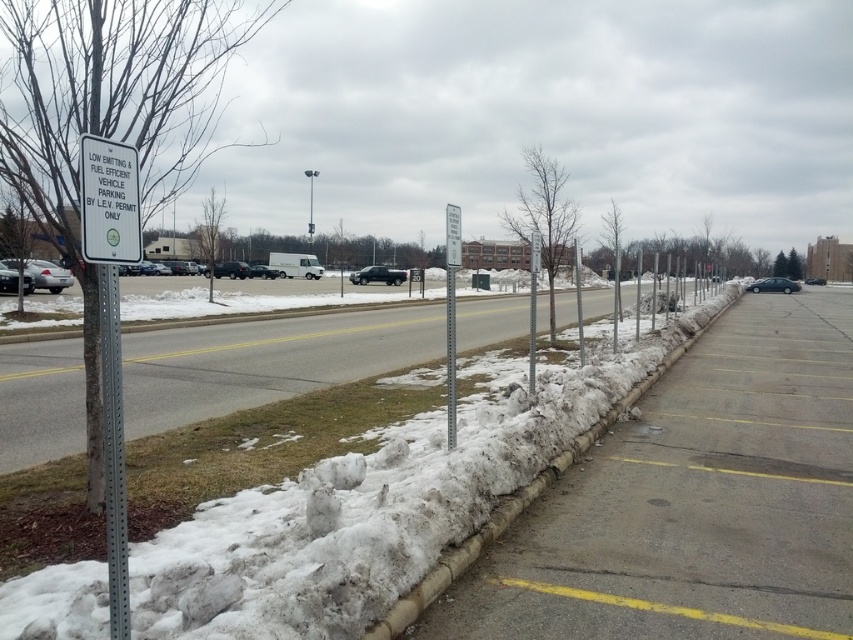
Which is more to the right, gray asphalt pavement at center or white fluffy snow at center?

gray asphalt pavement at center

Does gray asphalt pavement at center have a smaller size compared to white fluffy snow at center?

Incorrect, gray asphalt pavement at center is not smaller in size than white fluffy snow at center.

Locate an element on the screen. The width and height of the screenshot is (853, 640). gray asphalt pavement at center is located at coordinates (694, 500).

Locate an element on the screen. Image resolution: width=853 pixels, height=640 pixels. gray asphalt pavement at center is located at coordinates (694, 500).

Is metallic gray pole at center taller than matte black truck at center?

Indeed, metallic gray pole at center has a greater height compared to matte black truck at center.

Can you confirm if metallic gray pole at center is positioned above matte black truck at center?

No.

Is point (454, 426) more distant than point (384, 266)?

No, (454, 426) is closer to viewer.

Locate an element on the screen. metallic gray pole at center is located at coordinates (450, 356).

Which is more to the right, white fluffy snow at center or matte black truck at center?

white fluffy snow at center

Which is behind, point (374, 513) or point (399, 269)?

The point (399, 269) is behind.

In order to click on white fluffy snow at center in this screenshot , I will do `click(375, 508)`.